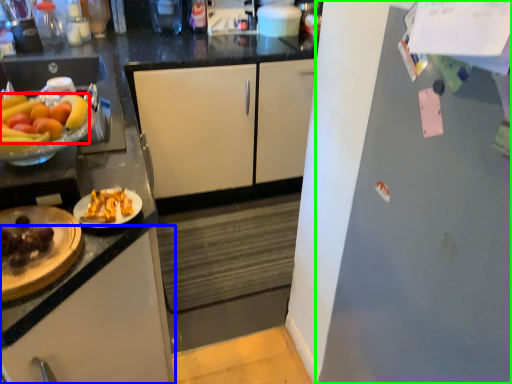
Question: Considering the real-world distances, which object is farthest from grapefruit (highlighted by a red box)? cabinetry (highlighted by a blue box) or refrigerator (highlighted by a green box)?

Choices:
 (A) cabinetry
 (B) refrigerator

Answer: (B)